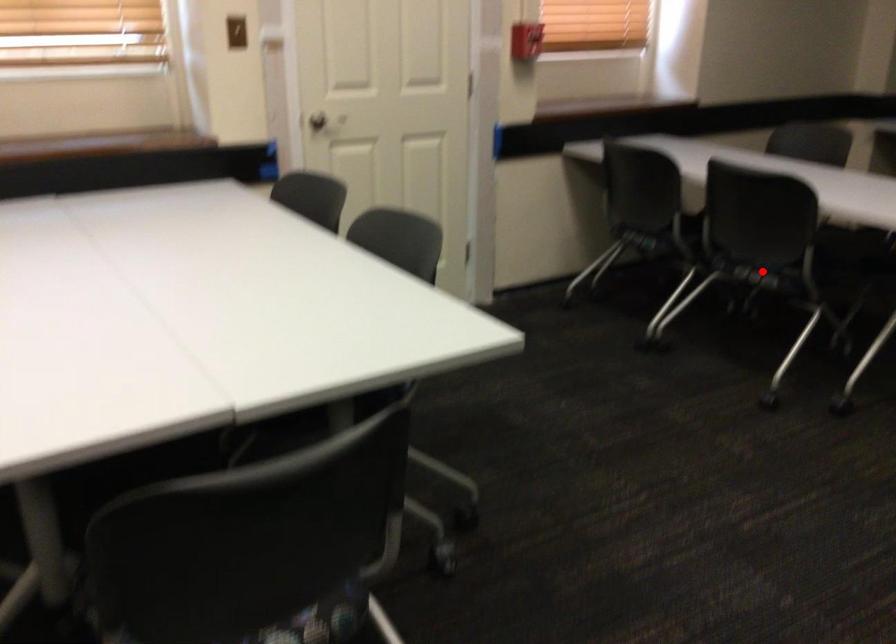
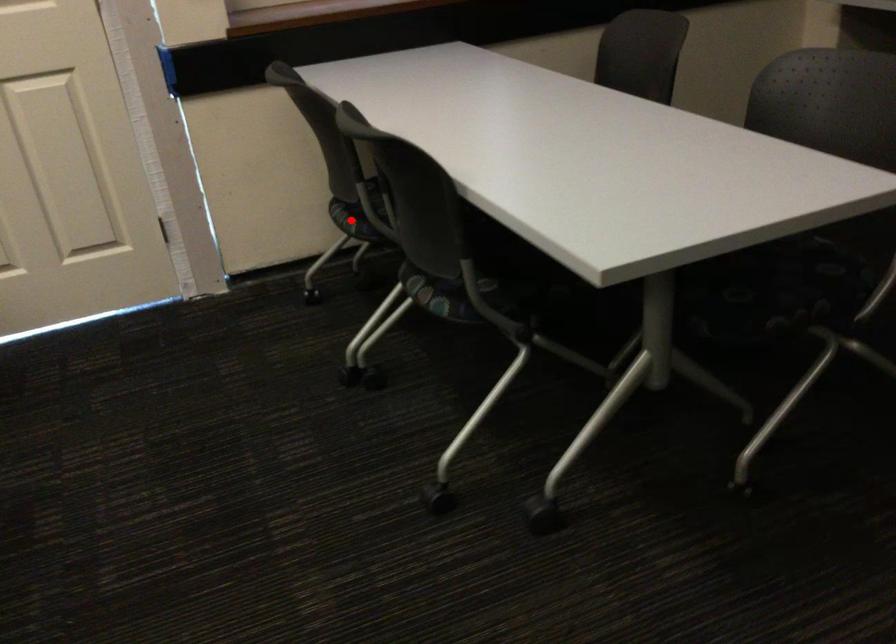
I am providing you with two images of the same scene from different viewpoints. A red point is marked on the first image and another point is marked on the second image. Do the highlighted points in image1 and image2 indicate the same real-world spot?

No